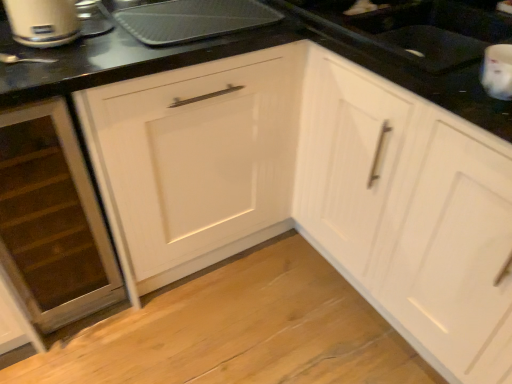
Where is `vacant region to the right of matte silver toaster at upper left`? vacant region to the right of matte silver toaster at upper left is located at coordinates [122, 45].